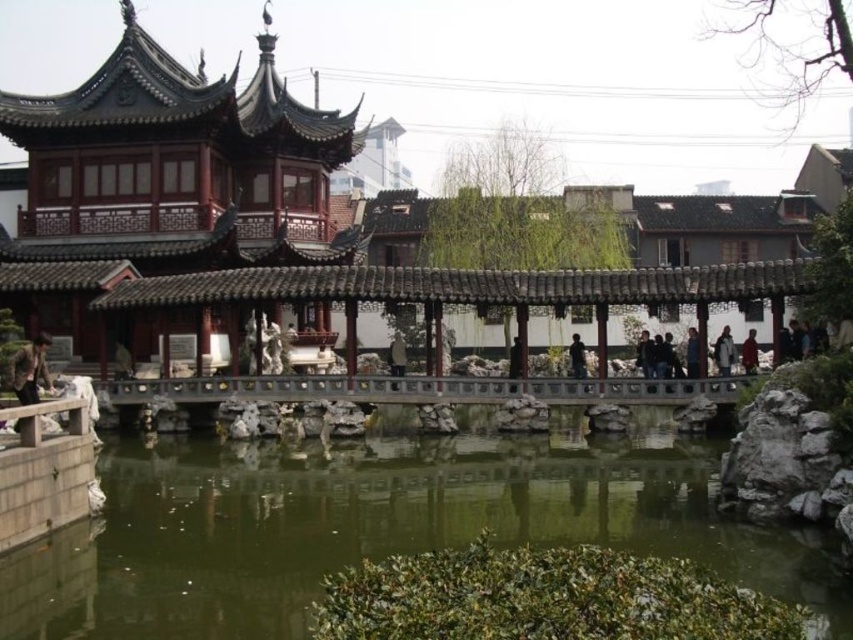
Question: Which point appears closest to the camera in this image?

Choices:
 (A) (125, 365)
 (B) (32, 358)
 (C) (692, 365)
 (D) (573, 369)

Answer: (B)

Question: Which of the following is the closest to the observer?

Choices:
 (A) (691, 362)
 (B) (581, 353)
 (C) (393, 374)
 (D) (721, 352)

Answer: (D)

Question: Does brown leather jacket at lower left have a greater width compared to light brown wooden statue at center?

Choices:
 (A) no
 (B) yes

Answer: (B)

Question: Where is green reflective water at center located in relation to red matte jacket at right in the image?

Choices:
 (A) right
 (B) left

Answer: (B)

Question: Considering the real-world distances, which object is farthest from the matte red wooden palace at center?

Choices:
 (A) green reflective water at center
 (B) dark gray fabric coat at center
 (C) brown leather jacket at lower left
 (D) dark blue jeans at center

Answer: (B)

Question: Where is brown leather jacket at lower left located in relation to dark brown wooden figure at center in the image?

Choices:
 (A) right
 (B) left

Answer: (B)